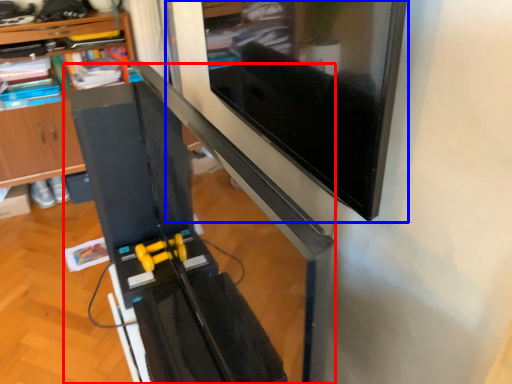
Question: Which object appears farthest to the camera in this image, computer desk (highlighted by a red box) or computer monitor (highlighted by a blue box)?

Choices:
 (A) computer desk
 (B) computer monitor

Answer: (B)